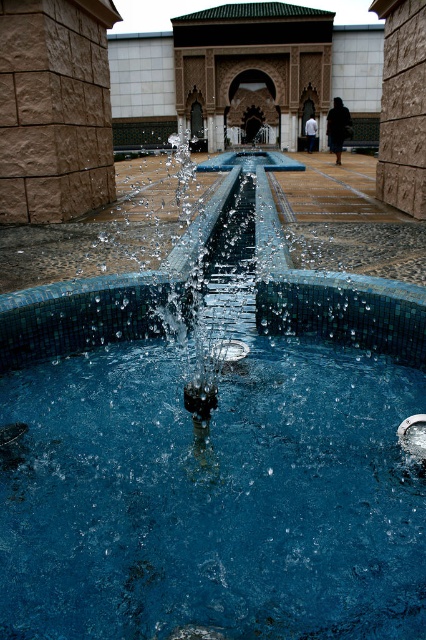
Question: Which point is farther to the camera?

Choices:
 (A) blue mosaic fountain at center
 (B) blue glossy water at center

Answer: (A)

Question: Is blue glossy water at center wider than blue mosaic fountain at center?

Choices:
 (A) no
 (B) yes

Answer: (A)

Question: Observing the image, what is the correct spatial positioning of blue glossy water at center in reference to blue mosaic fountain at center?

Choices:
 (A) left
 (B) right

Answer: (A)

Question: Is blue glossy water at center behind blue mosaic fountain at center?

Choices:
 (A) yes
 (B) no

Answer: (B)

Question: Which object appears farthest from the camera in this image?

Choices:
 (A) blue mosaic fountain at center
 (B) blue glossy water at center

Answer: (A)